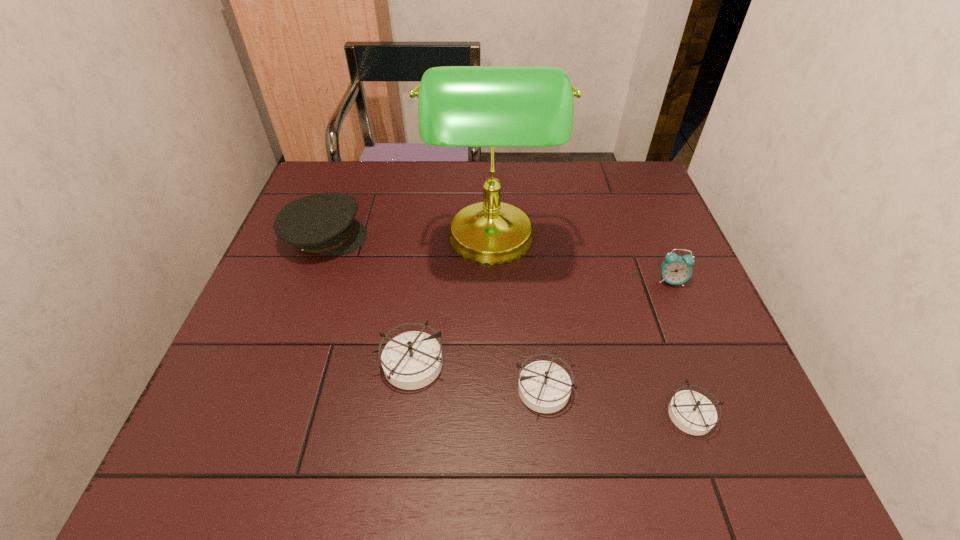
Where is `blank space at the far edge of the desktop`? blank space at the far edge of the desktop is located at coordinates (564, 172).

In the image, there is a desktop. Where is `vacant space at the near edge`? Image resolution: width=960 pixels, height=540 pixels. vacant space at the near edge is located at coordinates pyautogui.click(x=351, y=407).

I want to click on vacant space at the left edge of the desktop, so click(324, 278).

Identify the location of free space at the right edge of the desktop. The image size is (960, 540). (643, 231).

Identify the location of free space at the far left corner. (354, 166).

In the image, there is a desktop. Identify the location of vacant space at the far right corner. The height and width of the screenshot is (540, 960). (631, 200).

The height and width of the screenshot is (540, 960). I want to click on free space between the lamp and the tallest compass, so click(x=451, y=303).

In order to click on vacant space that's between the tallest object and the tallest compass in this screenshot , I will do `click(451, 303)`.

Locate an element on the screen. free spot between the beret and the leftmost compass is located at coordinates (369, 301).

Locate an element on the screen. free space that is in between the rightmost compass and the second compass from right to left is located at coordinates (617, 401).